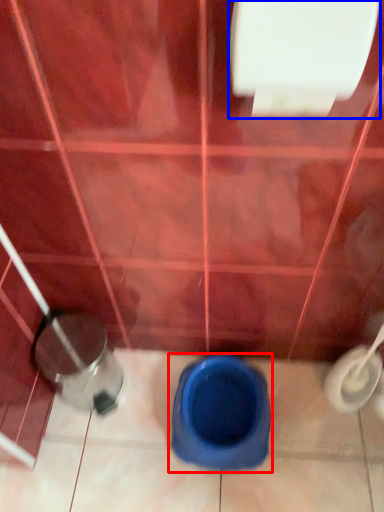
Question: Among these objects, which one is nearest to the camera, toilet (highlighted by a red box) or toilet paper (highlighted by a blue box)?

Choices:
 (A) toilet
 (B) toilet paper

Answer: (B)